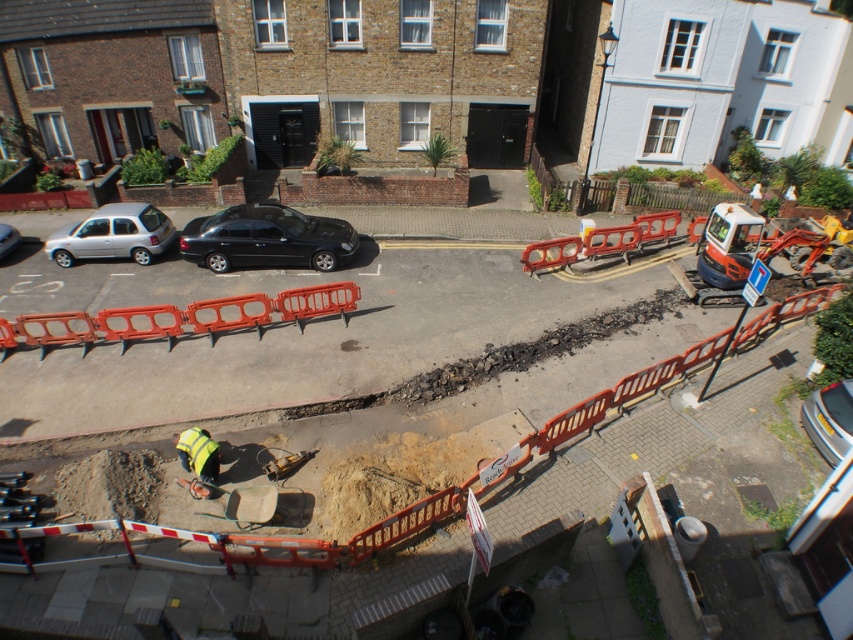
Does silver metallic car at lower right have a smaller size compared to reflective yellow vest at center?

Incorrect, silver metallic car at lower right is not smaller in size than reflective yellow vest at center.

Is point (828, 394) farther from camera compared to point (209, 436)?

Yes.

Describe the element at coordinates (828, 419) in the screenshot. This screenshot has height=640, width=853. I see `silver metallic car at lower right` at that location.

The height and width of the screenshot is (640, 853). Identify the location of silver metallic car at lower right. (828, 419).

Can you confirm if reflective yellow vest at center is thinner than silver metallic car at left?

In fact, reflective yellow vest at center might be wider than silver metallic car at left.

Who is taller, reflective yellow vest at center or silver metallic car at left?

Standing taller between the two is silver metallic car at left.

At what (x,y) coordinates should I click in order to perform the action: click on reflective yellow vest at center. Please return your answer as a coordinate pair (x, y). The image size is (853, 640). Looking at the image, I should click on (198, 452).

Is black glossy sedan at center above silver metallic car at lower right?

Yes, black glossy sedan at center is above silver metallic car at lower right.

Measure the distance between black glossy sedan at center and camera.

black glossy sedan at center and camera are 16.19 meters apart from each other.

Between point (310, 234) and point (813, 417), which one is positioned behind?

The point (310, 234) is behind.

In order to click on black glossy sedan at center in this screenshot , I will do `click(265, 237)`.